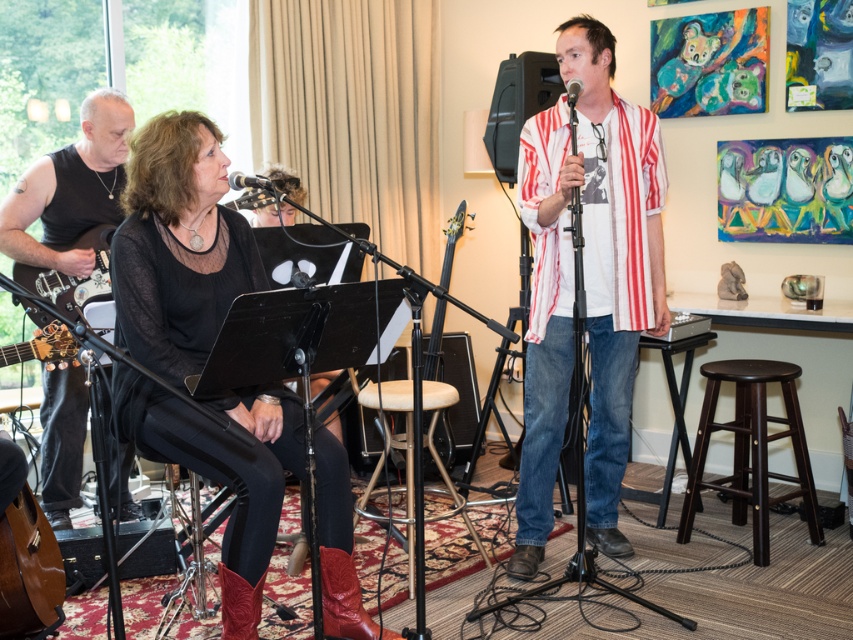
Consider the image. You are a stagehand setting up a spotlight for the performers. The spotlight can only illuminate objects above a certain height. You need to decide whether to aim it at the matte black dress at center or the white striped shirt at center. Based on their positions, which one is higher and should be targeted?

The white striped shirt at center is higher than the matte black dress at center, so the spotlight should be aimed at the white striped shirt at center.

In the scene shown: You are a photographer positioned behind the performers. You want to capture a photo that includes both the white striped shirt at center and the black leather guitar at left. Can you see both objects in your frame without moving your camera?

Yes, because the white striped shirt at center is in front of the black leather guitar at left, so both can be seen in the frame as long as the camera is positioned to include both in the composition.